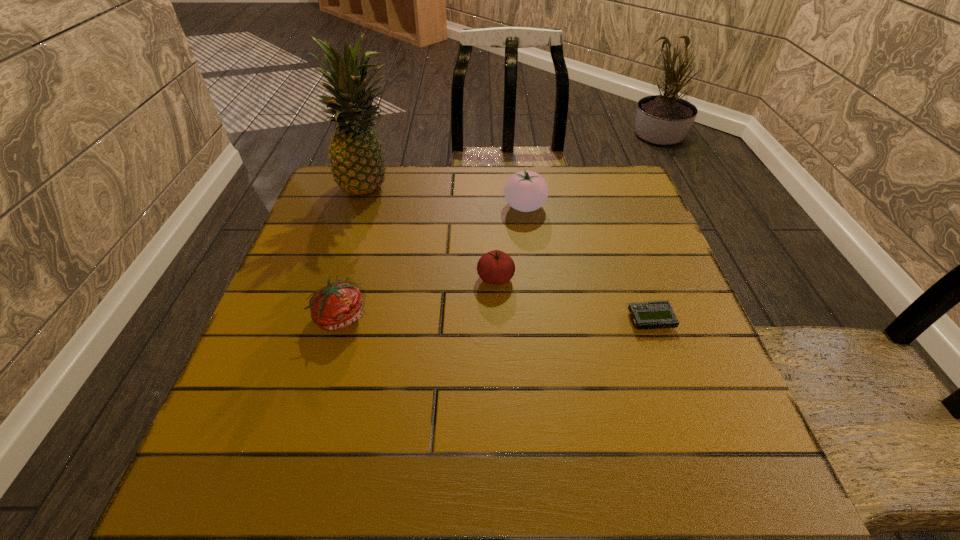
Where is `vacant region at the left edge of the desktop`? The image size is (960, 540). vacant region at the left edge of the desktop is located at coordinates (317, 374).

Image resolution: width=960 pixels, height=540 pixels. Identify the location of vacant space at the right edge of the desktop. [688, 420].

In the image, there is a desktop. Identify the location of free space at the near left corner. This screenshot has height=540, width=960. click(x=212, y=451).

You are a GUI agent. You are given a task and a screenshot of the screen. Output one action in this format:
    pyautogui.click(x=<x>, y=<y>)
    Task: Click on the free space at the far right corner of the desktop
    
    Given the screenshot: What is the action you would take?
    pyautogui.click(x=600, y=190)

Identify the location of unoccupied position between the second farthest tomato and the fourth shortest object. (511, 242).

This screenshot has height=540, width=960. I want to click on empty space between the second farthest tomato and the beeper, so (573, 299).

In order to click on empty space that is in between the third nearest object and the tallest object in this screenshot , I will do `click(433, 232)`.

What are the coordinates of `free point between the farthest tomato and the third nearest object` in the screenshot? It's located at (511, 242).

I want to click on empty location between the second tallest object and the leftmost tomato, so click(x=433, y=262).

This screenshot has height=540, width=960. In order to click on vacant area that lies between the leftmost tomato and the pineapple in this screenshot , I will do click(x=356, y=251).